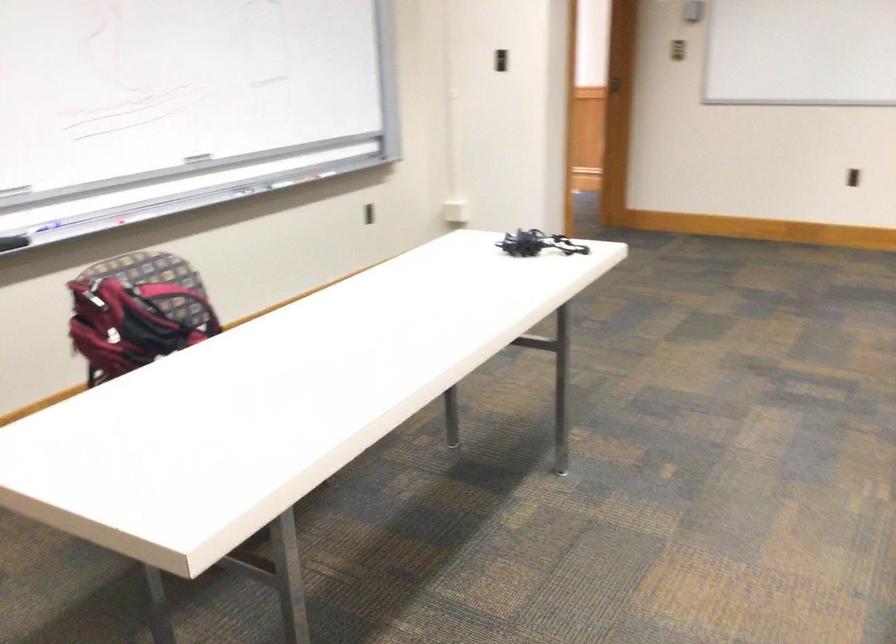
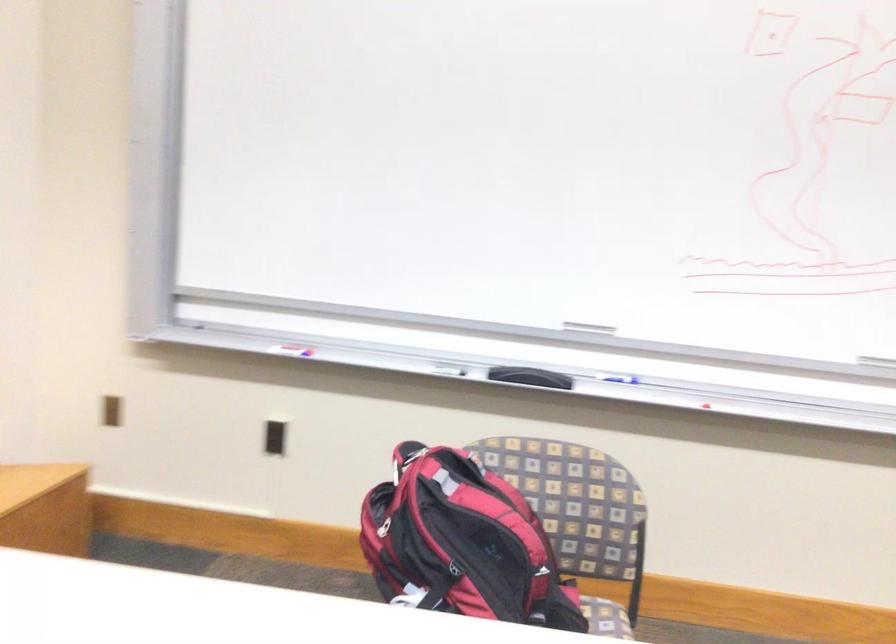
Find the pixel in the second image that matches (x=108, y=339) in the first image.

(383, 527)